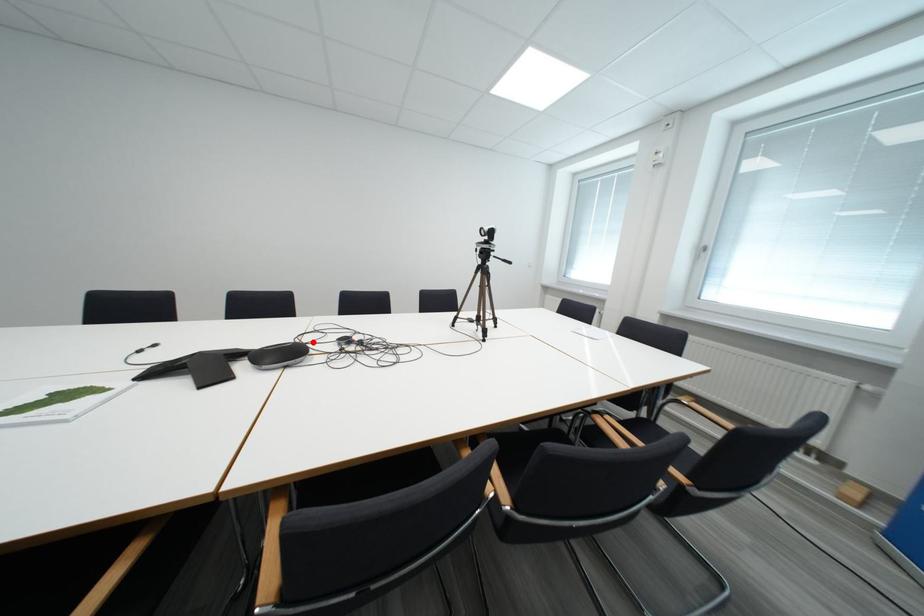
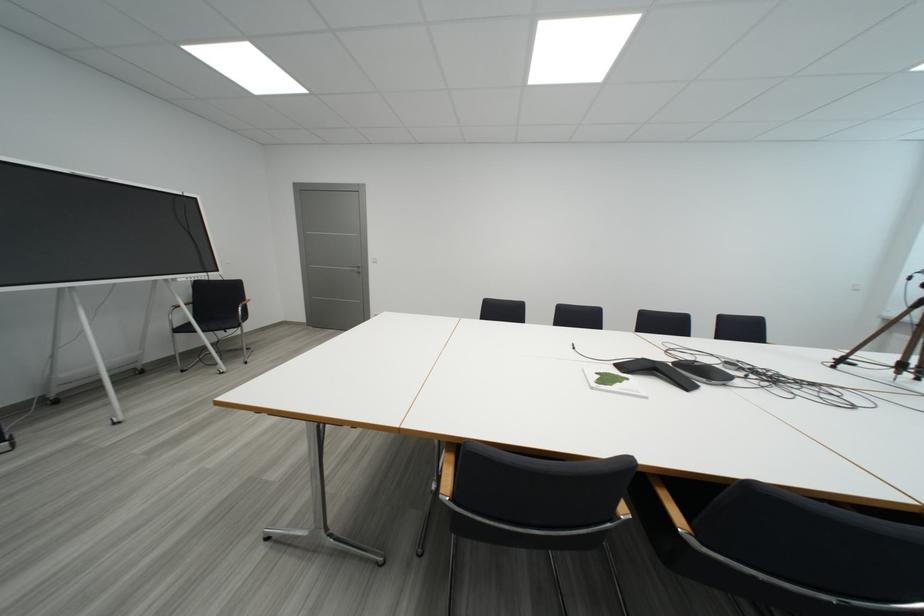
Find the pixel in the second image that matches the highlighted location in the first image.

(697, 361)